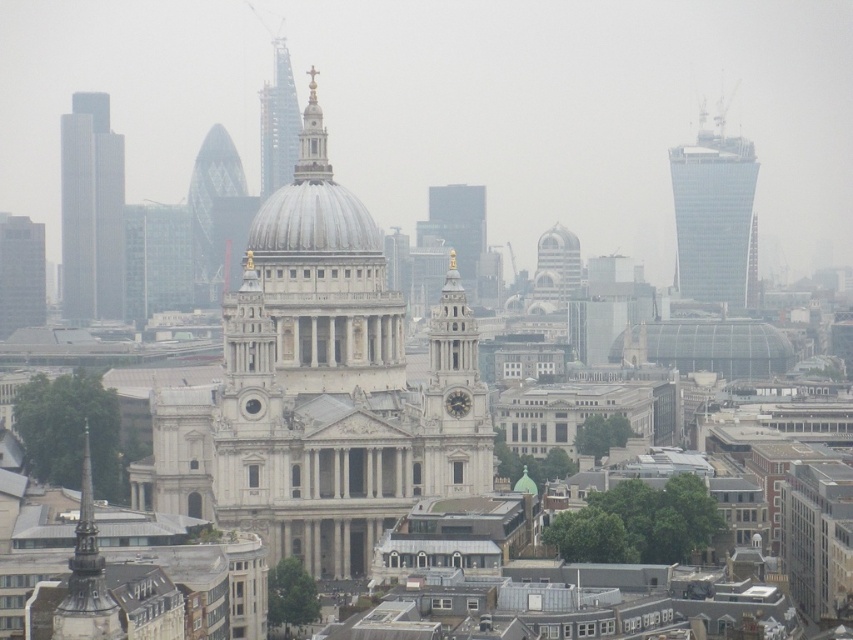
You are an architect analyzing the cityscape. You notice the white marble dome at center and the metallic scaffolding at upper center. Which of these two objects has a greater visual prominence in the image?

The white marble dome at center has greater visual prominence because it is larger in size than the metallic scaffolding at upper center.

You are an architect analyzing the cityscape. You need to compare the sizes of the white marble dome at center and the metallic scaffolding at upper center. Which one appears wider?

The white marble dome at center appears wider than the metallic scaffolding at upper center because its width is larger according to the description.

You are standing in the city square looking at the white glass tower at center. You want to take a photo of it from a closer position. If you walk 500 feet towards the tower, will you be able to get a better view of the entire structure without any obstructions?

The white glass tower at center is currently 1131.02 feet away from you. If you walk 500 feet towards it, you will be 631.02 feet away. At this distance, you should have a clearer and less obstructed view of the entire tower, assuming there are no other buildings or structures blocking your path.